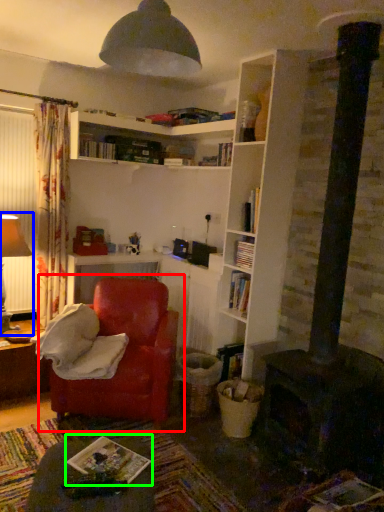
Question: Which is farther away from chair (highlighted by a red box)? table lamp (highlighted by a blue box) or book (highlighted by a green box)?

Choices:
 (A) table lamp
 (B) book

Answer: (A)